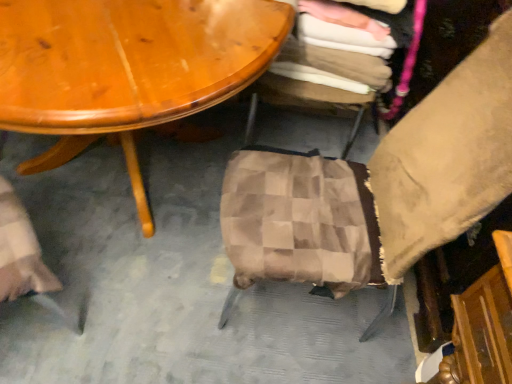
This screenshot has width=512, height=384. In order to click on vacant area that lies in front of brown checkered fabric at center, arranged as the second chair when viewed from the back in this screenshot , I will do `click(207, 343)`.